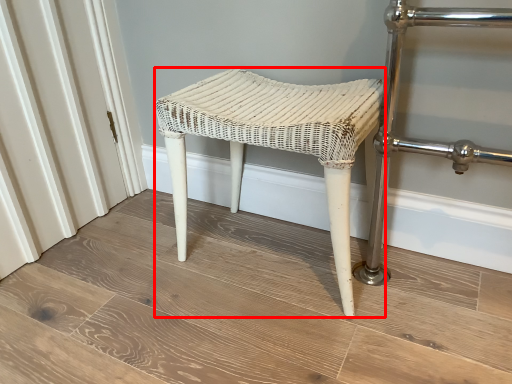
Question: Observing the image, what is the correct spatial positioning of stool (annotated by the red box) in reference to plank?

Choices:
 (A) left
 (B) right

Answer: (B)